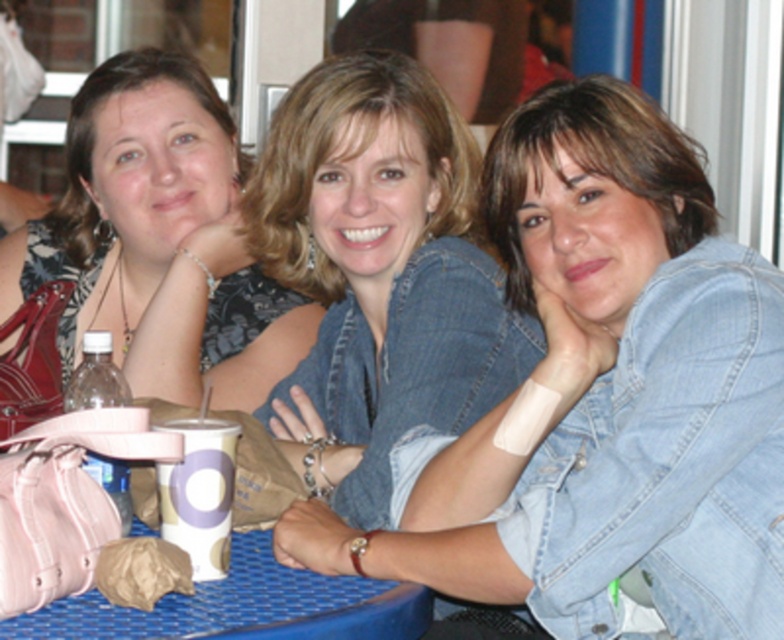
You are a photographer setting up a tripod at the center of the image. You need to ensure that the faded denim jacket at lower right does not block the view of the center woman. Based on its coordinates, will the jacket be in the way?

The faded denim jacket at lower right is located at point (601, 401), which is to the right and below the center of the image. Since the center woman is positioned centrally, the jacket is positioned to the lower right and thus will not block her view from the center. Therefore, the jacket will not obstruct the photographer capturing the center woman without any issues.

Based on the scene description, which object is positioned lower in the image, the denim jacket at center or the matte black dress at upper left?

The denim jacket at center is positioned lower than the matte black dress at upper left.

You are a photographer standing 2 meters away from the denim jacket at center. Can you reach it without moving?

The denim jacket at center is 2.50 meters away from the camera, so you are 0.5 meters away from it. Since you can reach about 1 meter, you can reach it without moving.